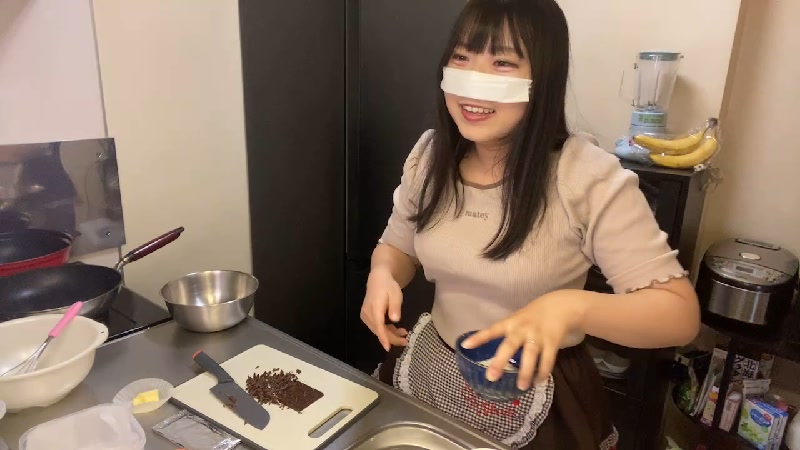
Image resolution: width=800 pixels, height=450 pixels. What are the coordinates of `blue bowl` in the screenshot? It's located at (490, 380).